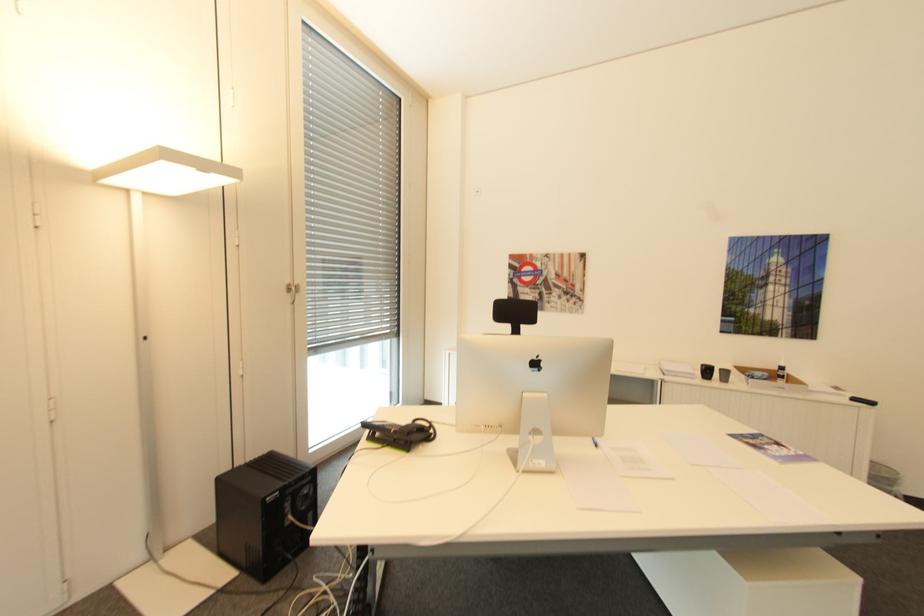
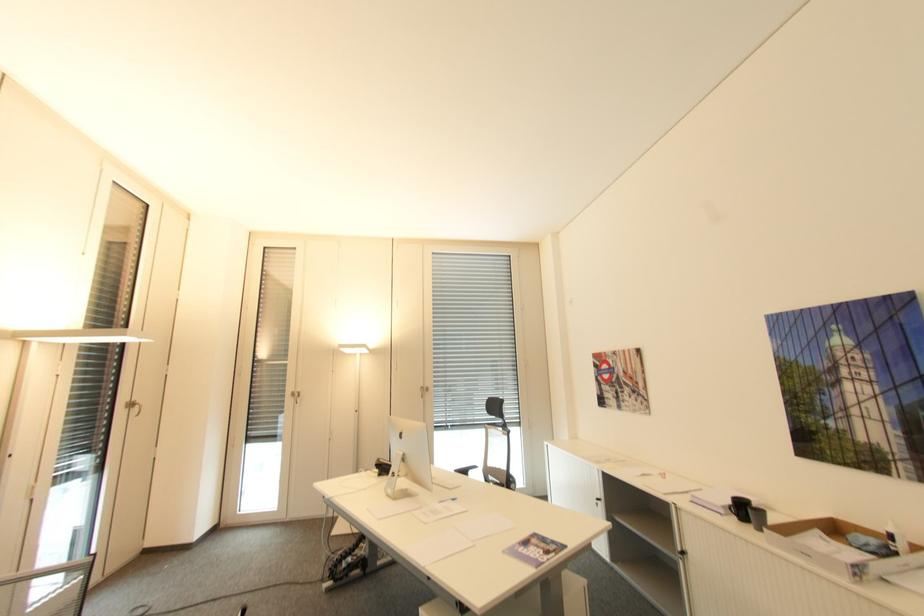
Where in the second image is the point corresponding to point 786,368 from the first image?

(895, 537)